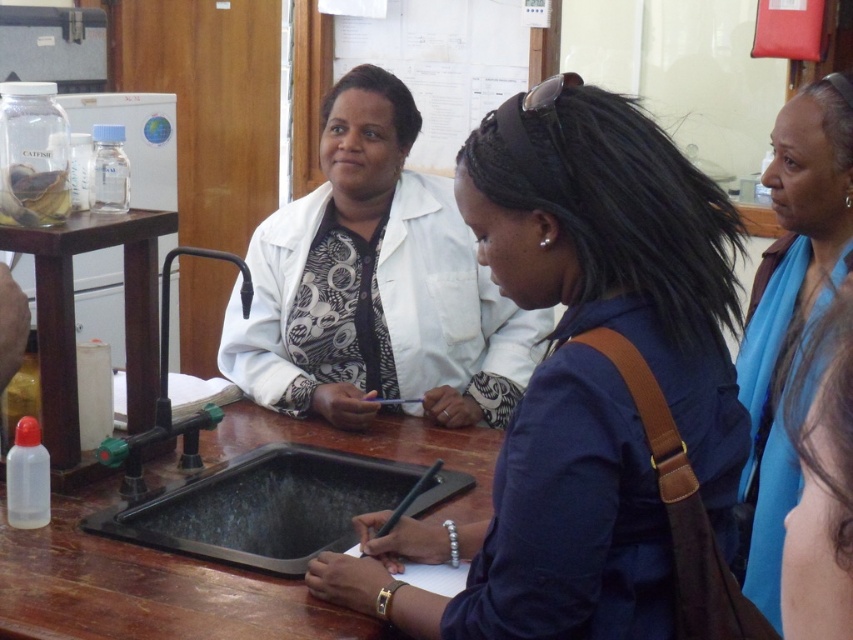
Is matte white lab coat at center to the left of blue scarf at upper right from the viewer's perspective?

Yes, matte white lab coat at center is to the left of blue scarf at upper right.

Who is taller, matte white lab coat at center or blue scarf at upper right?

blue scarf at upper right

Does point (476, 198) lie in front of point (773, 285)?

Yes.

The width and height of the screenshot is (853, 640). In order to click on matte white lab coat at center in this screenshot , I will do point(579,380).

Is point (753, 406) behind point (166, 442)?

No, it is not.

Looking at this image, is blue scarf at upper right thinner than transparent plastic bottle at left?

Yes, blue scarf at upper right is thinner than transparent plastic bottle at left.

Between point (753, 428) and point (103, 243), which one is positioned behind?

The point (103, 243) is more distant.

You are a GUI agent. You are given a task and a screenshot of the screen. Output one action in this format:
    pyautogui.click(x=<x>, y=<y>)
    Task: Click on the blue scarf at upper right
    This screenshot has height=640, width=853.
    Given the screenshot: What is the action you would take?
    pyautogui.click(x=790, y=308)

Can you confirm if white lab coat at center is positioned above wooden table at center?

Indeed, white lab coat at center is positioned over wooden table at center.

Is white lab coat at center to the right of wooden table at center from the viewer's perspective?

Yes, white lab coat at center is to the right of wooden table at center.

Find the location of `white lab coat at center`. white lab coat at center is located at coordinates (375, 284).

This screenshot has width=853, height=640. In order to click on white lab coat at center in this screenshot , I will do `click(375, 284)`.